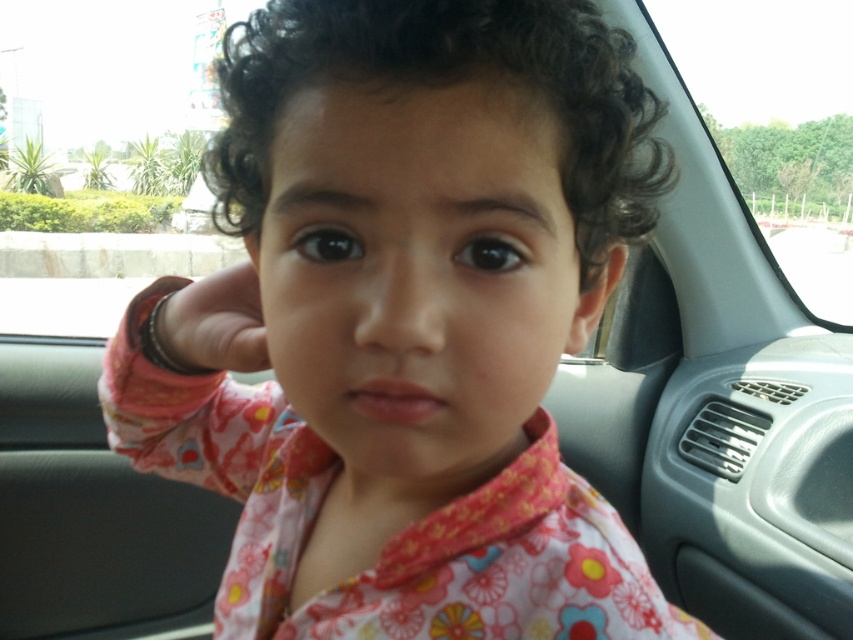
Between point (467, 93) and point (213, 275), which one is positioned behind?

Point (213, 275)

Is floral fabric shirt at center smaller than metallic bracelet at left?

No, floral fabric shirt at center is not smaller than metallic bracelet at left.

Is point (222, 394) more distant than point (231, 273)?

Yes, it is.

At what (x,y) coordinates should I click in order to perform the action: click on floral fabric shirt at center. Please return your answer as a coordinate pair (x, y). Image resolution: width=853 pixels, height=640 pixels. Looking at the image, I should click on (410, 323).

Image resolution: width=853 pixels, height=640 pixels. What do you see at coordinates (776, 120) in the screenshot?
I see `transparent glass car window at upper right` at bounding box center [776, 120].

Is transparent glass car window at upper right to the right of metallic bracelet at left from the viewer's perspective?

Yes, transparent glass car window at upper right is to the right of metallic bracelet at left.

Which is behind, point (695, 58) or point (163, 326)?

Positioned behind is point (695, 58).

Where is `transparent glass car window at upper right`? The image size is (853, 640). transparent glass car window at upper right is located at coordinates (776, 120).

Which of these two, floral fabric shirt at center or transparent glass car window at upper right, stands shorter?

transparent glass car window at upper right is shorter.

Can you confirm if floral fabric shirt at center is bigger than transparent glass car window at upper right?

Yes.

Between point (134, 458) and point (706, 81), which one is positioned behind?

Positioned behind is point (706, 81).

The width and height of the screenshot is (853, 640). I want to click on floral fabric shirt at center, so click(x=410, y=323).